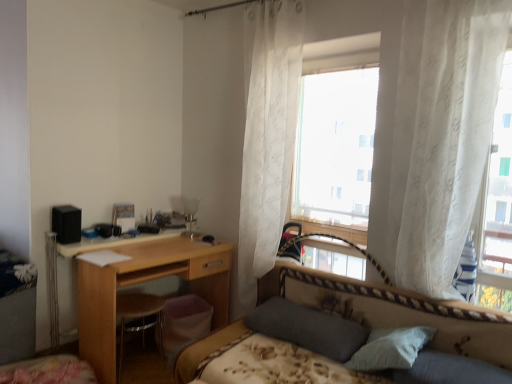
Image resolution: width=512 pixels, height=384 pixels. In order to click on blank area beneath white sheer curtain at upper right, placed as the first curtain when sorted from front to back (from a real-world perspective) in this screenshot , I will do `click(428, 304)`.